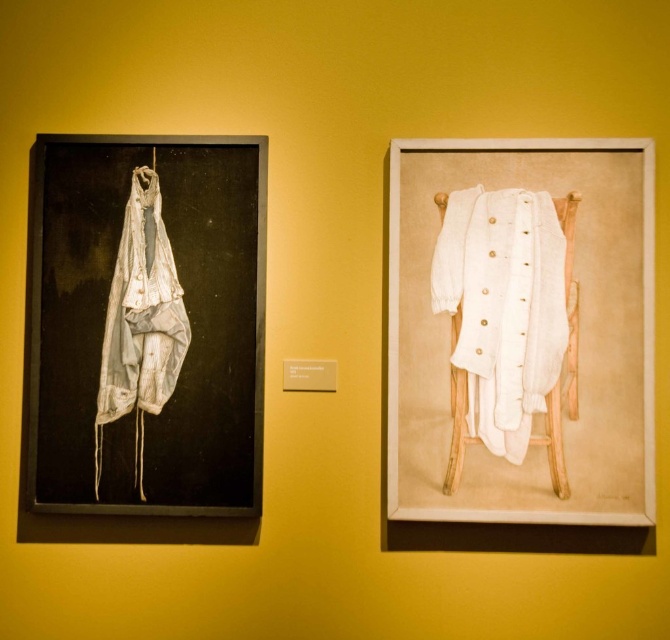
Question: Which point is closer to the camera?

Choices:
 (A) white cotton coat at right
 (B) white tattered cloth at left

Answer: (A)

Question: Where is white cotton coat at right located in relation to matte white hanger at upper left in the image?

Choices:
 (A) above
 (B) below

Answer: (B)

Question: Is white fabric pants at left smaller than matte white hanger at upper left?

Choices:
 (A) yes
 (B) no

Answer: (B)

Question: Does white cotton coat at right appear over white cotton robe at center?

Choices:
 (A) no
 (B) yes

Answer: (A)

Question: Estimate the real-world distances between objects in this image. Which object is farther from the white tattered cloth at left?

Choices:
 (A) white fabric pants at left
 (B) matte white hanger at upper left
 (C) white cotton coat at right

Answer: (C)

Question: Which of the following is the farthest from the observer?

Choices:
 (A) white fabric pants at left
 (B) white cotton coat at right
 (C) white cotton robe at center

Answer: (A)